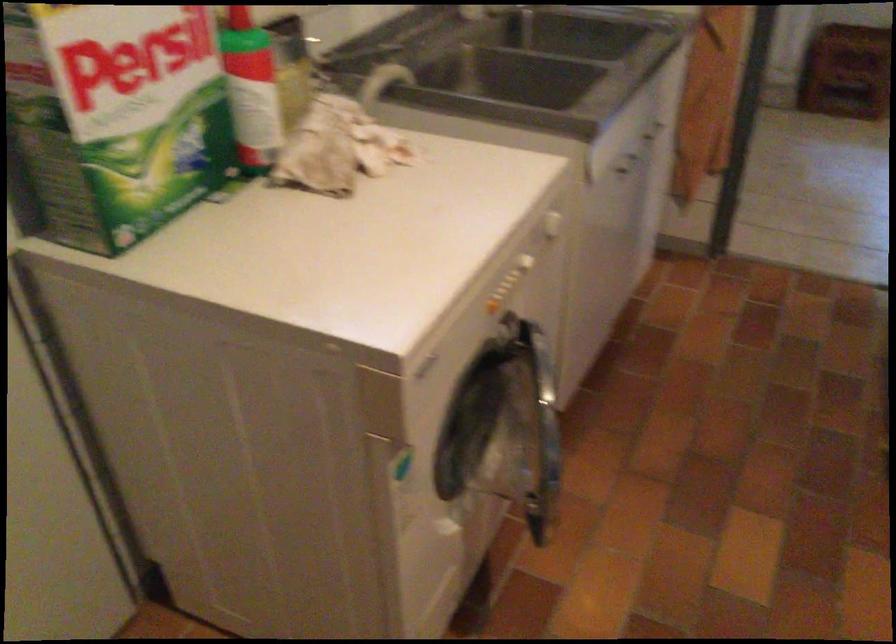
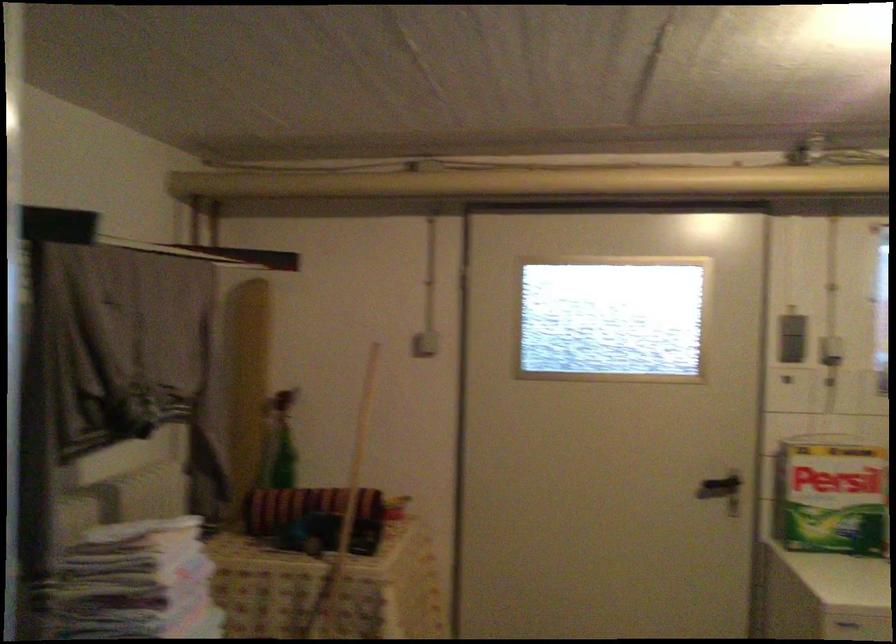
In the second image, find the point that corresponds to point 136,108 in the first image.

(831, 496)